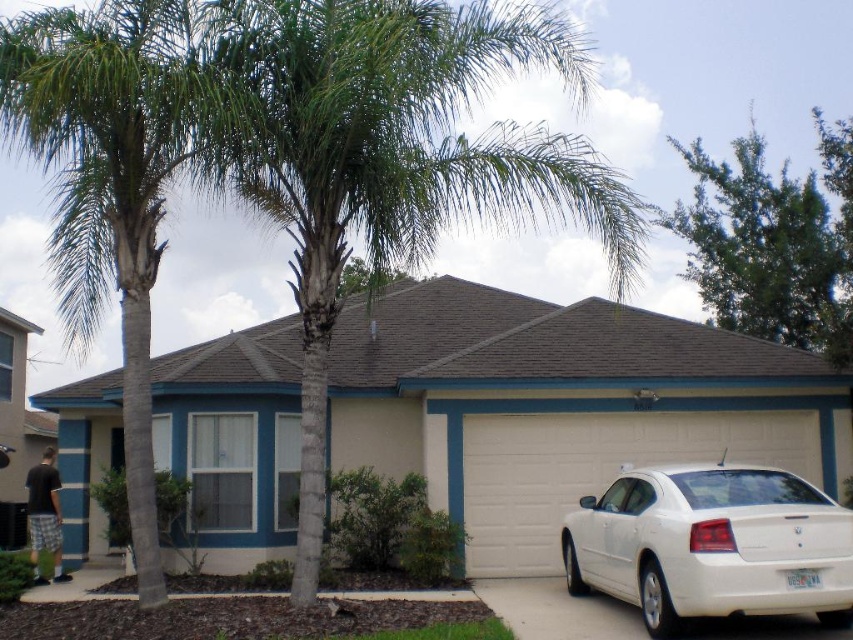
Question: Where is green leafy palm tree at center located in relation to white glossy sedan at lower right in the image?

Choices:
 (A) above
 (B) below

Answer: (A)

Question: Which object is farther from the camera taking this photo?

Choices:
 (A) green leafy palm tree at left
 (B) green leafy tree at upper right
 (C) white glossy sedan at lower right

Answer: (B)

Question: Which point appears farthest from the camera in this image?

Choices:
 (A) (51, 516)
 (B) (136, 412)
 (C) (683, 272)

Answer: (C)

Question: Does white glossy sedan at lower right appear on the right side of dark gray shorts at lower left?

Choices:
 (A) no
 (B) yes

Answer: (B)

Question: Does green leafy palm tree at left have a lesser width compared to dark gray shorts at lower left?

Choices:
 (A) yes
 (B) no

Answer: (B)

Question: Which object is positioned farthest from the white glossy sedan at lower right?

Choices:
 (A) dark gray shorts at lower left
 (B) green leafy palm tree at center

Answer: (A)